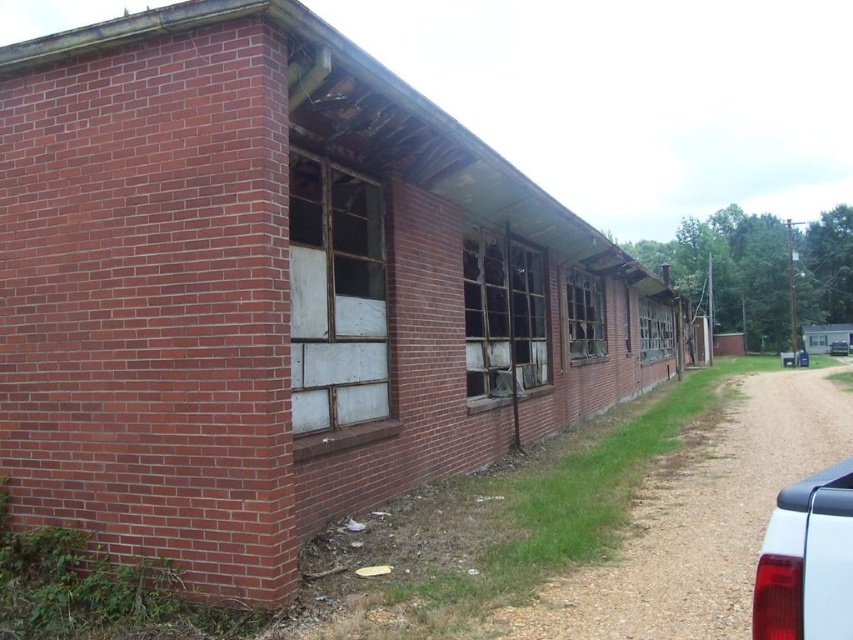
Can you confirm if transparent glass window at center is smaller than clear glass window at center?

Indeed, transparent glass window at center has a smaller size compared to clear glass window at center.

Between transparent glass window at center and clear glass window at center, which one is positioned lower?

clear glass window at center

What do you see at coordinates (584, 314) in the screenshot?
I see `transparent glass window at center` at bounding box center [584, 314].

Find the location of a particular element. transparent glass window at center is located at coordinates (584, 314).

Does white frosted glass window at center come in front of charred wood window at center?

Yes, it is.

The image size is (853, 640). What do you see at coordinates (335, 296) in the screenshot?
I see `white frosted glass window at center` at bounding box center [335, 296].

Where is `white frosted glass window at center`? white frosted glass window at center is located at coordinates (335, 296).

Who is more distant from viewer, [784,577] or [592,342]?

The point [592,342] is more distant.

This screenshot has width=853, height=640. What do you see at coordinates (807, 561) in the screenshot?
I see `matte red tail light at lower right` at bounding box center [807, 561].

Is point (813, 506) positioned behind point (576, 304)?

No, (813, 506) is closer to viewer.

Locate an element on the screen. The image size is (853, 640). matte red tail light at lower right is located at coordinates (807, 561).